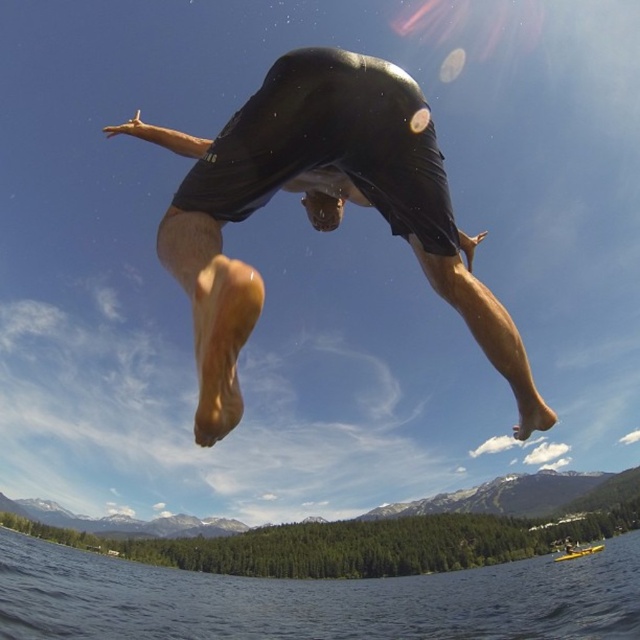
Looking at this image, you are a photographer trying to capture the perfect shot of the diver. You notice the black matte shorts at center and the transparent blue water at lower center. Which object appears narrower in the image?

The black matte shorts at center appears narrower than the transparent blue water at lower center.

You are a photographer trying to capture the black matte wetsuit at center and the yellow plastic boat at lower right in the same frame. Based on their sizes in the image, which object would appear smaller in the final photo?

The black matte wetsuit at center appears smaller in the final photo because it is not as tall as the yellow plastic boat at lower right.